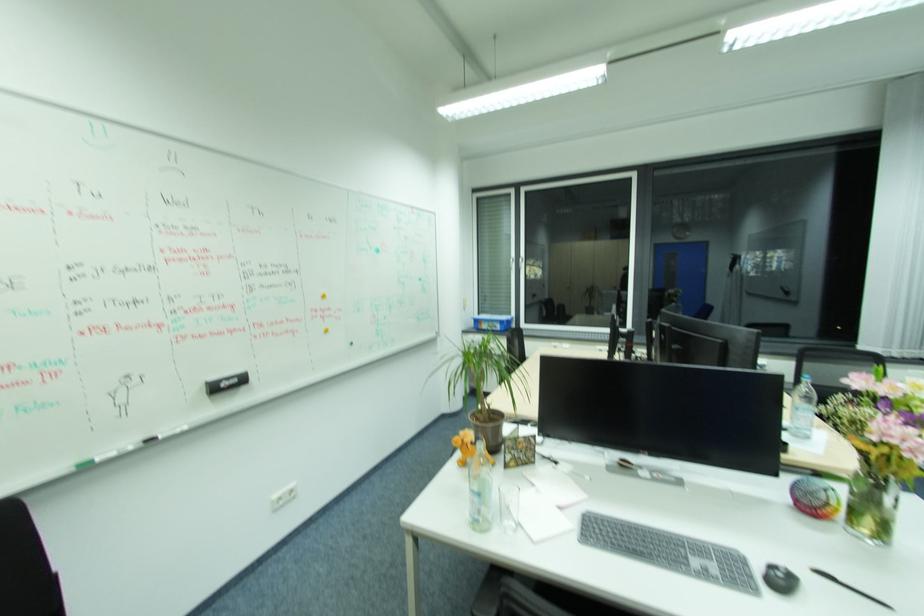
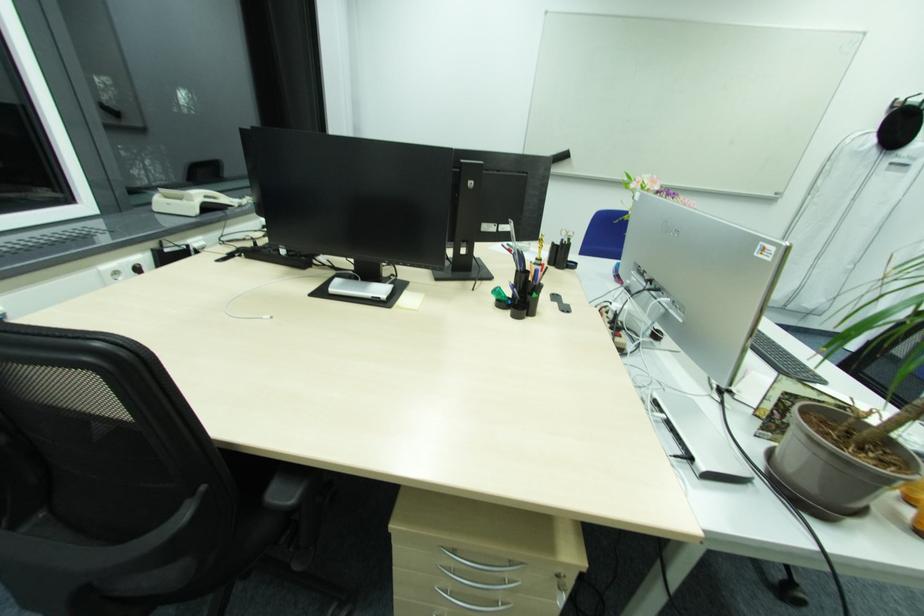
Where in the second image is the point corresponding to point 606,350 from the first image?

(120, 272)